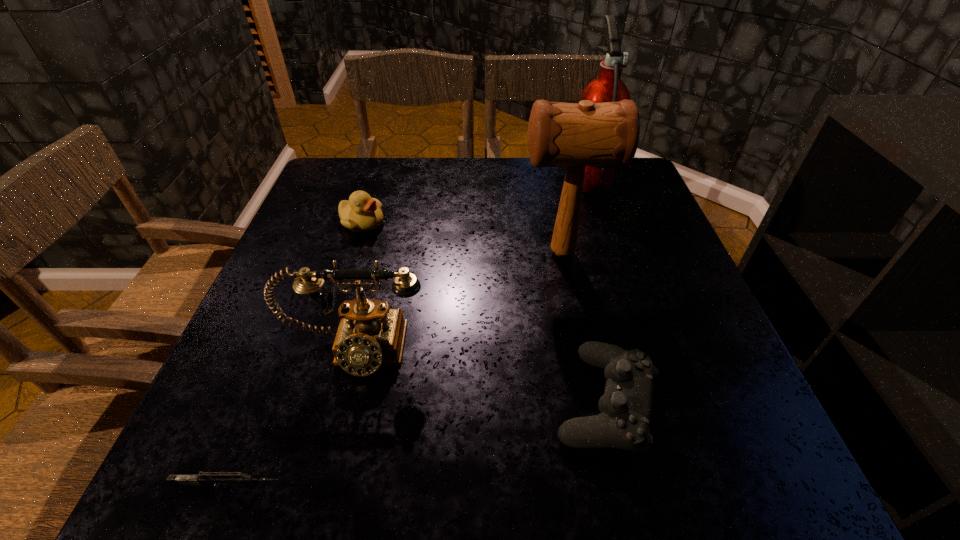
This screenshot has height=540, width=960. I want to click on free space that satisfies the following two spatial constraints: 1. on the strike surface of the mallet; 2. on the dial number of the fourth shortest object, so click(582, 350).